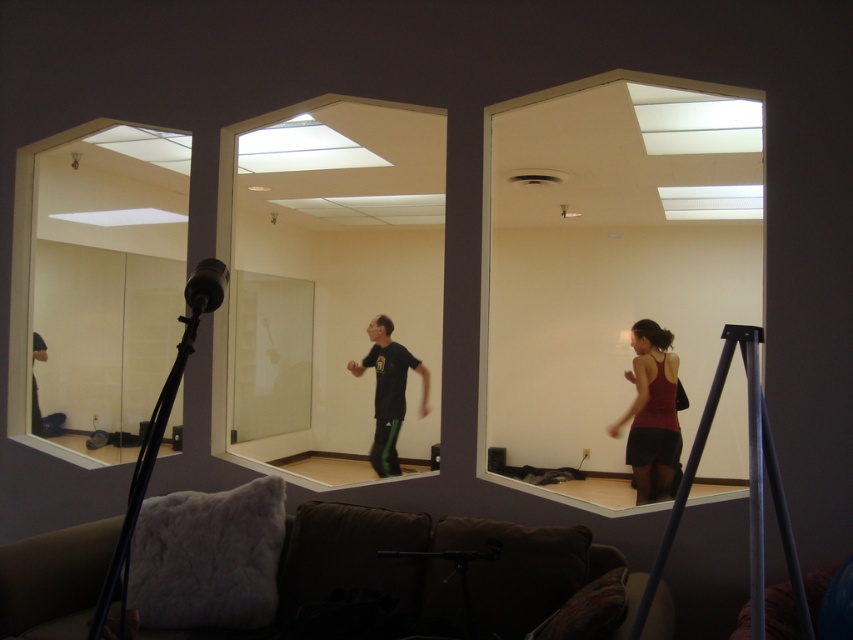
Question: Does clear glass mirror at left have a smaller size compared to matte red tank top at center?

Choices:
 (A) no
 (B) yes

Answer: (A)

Question: Estimate the real-world distances between objects in this image. Which object is closer to the black matte shirt at center?

Choices:
 (A) metallic tripod at right
 (B) matte red tank top at center
 (C) black matte tripod at lower left
 (D) clear glass mirror at center

Answer: (D)

Question: Can you confirm if matte red tank top at center is smaller than black matte tripod at lower left?

Choices:
 (A) yes
 (B) no

Answer: (A)

Question: Among these points, which one is farthest from the camera?

Choices:
 (A) (741, 326)
 (B) (61, 388)

Answer: (B)

Question: Does clear glass mirror at center appear over black matte shirt at center?

Choices:
 (A) yes
 (B) no

Answer: (A)

Question: Among these objects, which one is farthest from the camera?

Choices:
 (A) clear glass mirror at left
 (B) metallic tripod at right
 (C) black matte shirt at center
 (D) matte white mirror at center

Answer: (D)